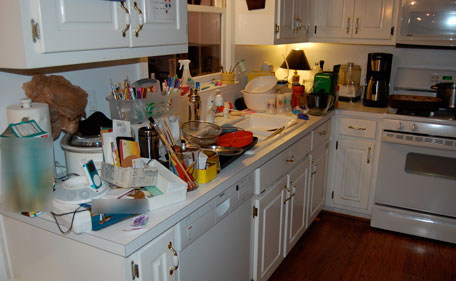
The height and width of the screenshot is (281, 456). Identify the location of cabinet door above counter. (76, 25), (164, 22), (289, 24), (333, 20), (372, 15).